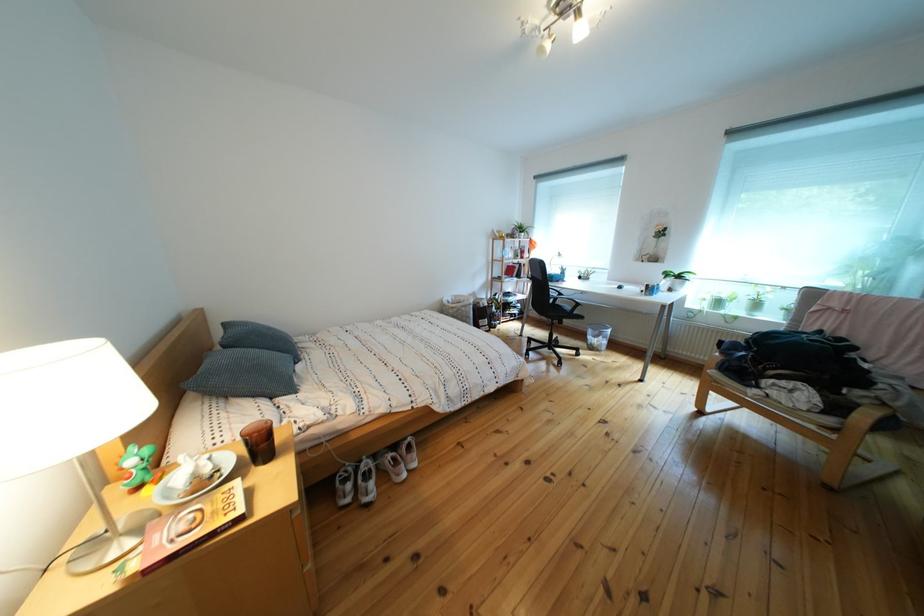
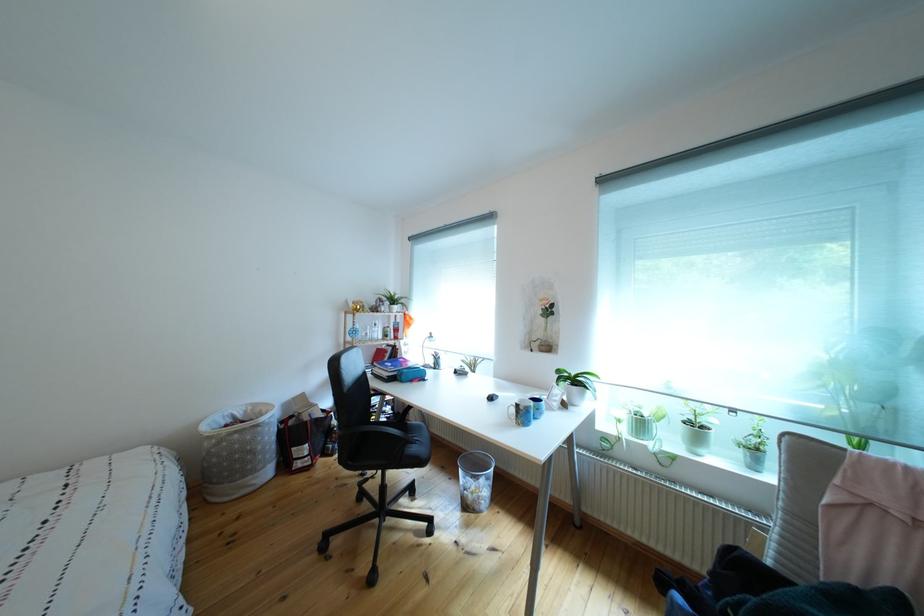
The point at (480, 323) is marked in the first image. Where is the corresponding point in the second image?

(263, 456)